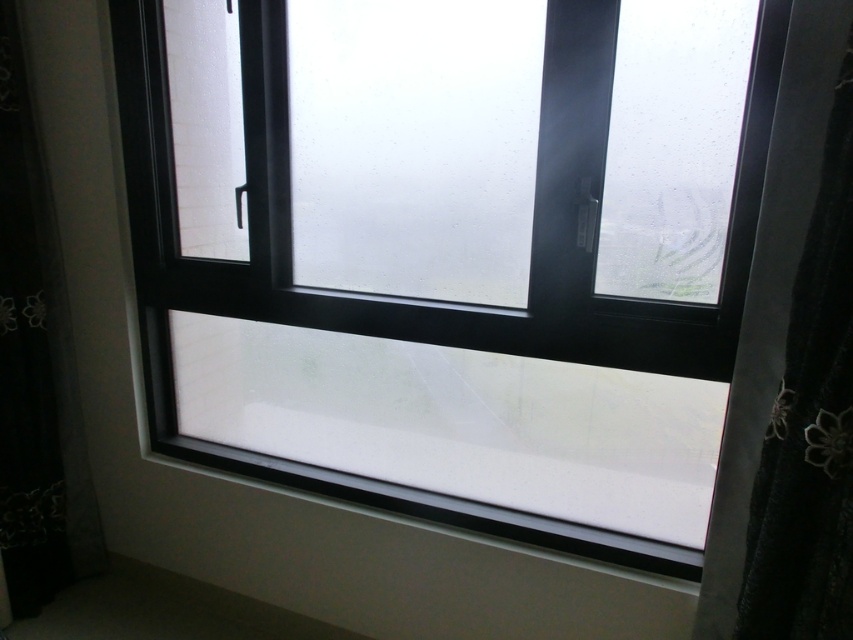
You are a window installer and need to ensure that the black textured curtain at right and the white smooth window sill at center are positioned correctly. Which object is taller?

The black textured curtain at right is much taller than the white smooth window sill at center.

You are standing in a room with a window. You see a transparent glass window at center and a white smooth window sill at center. Which object is positioned to the right side?

The transparent glass window at center is to the right of the white smooth window sill at center.

You are trying to place a small potted plant on the window sill. Based on the scene description, will the white smooth window sill at center be able to hold the transparent glass window at center?

The transparent glass window at center has a larger size compared to white smooth window sill at center, so the white smooth window sill at center may not be able to hold the transparent glass window at center due to its smaller size.